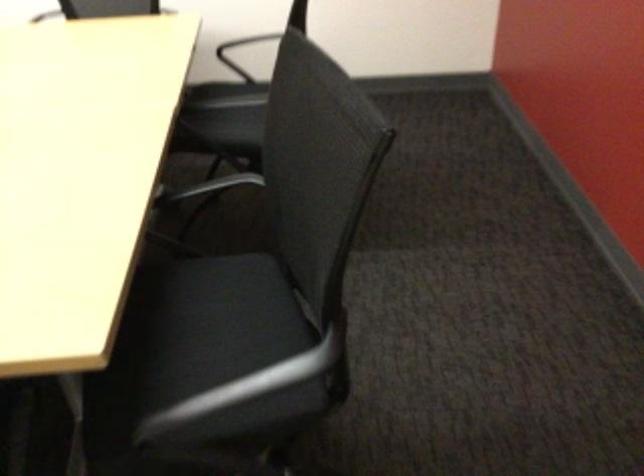
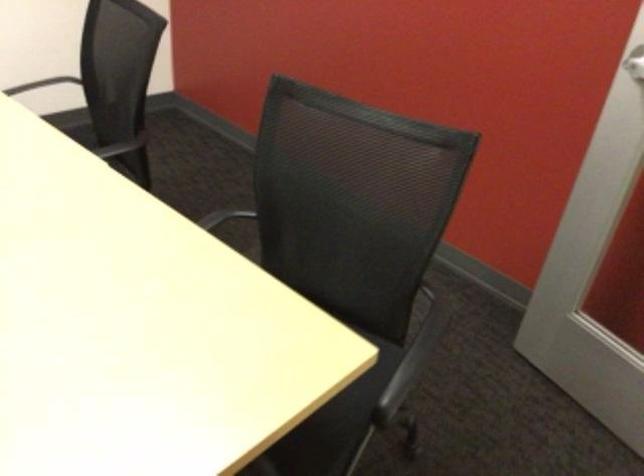
Locate, in the second image, the point that corresponds to (x=281, y=364) in the first image.

(430, 322)